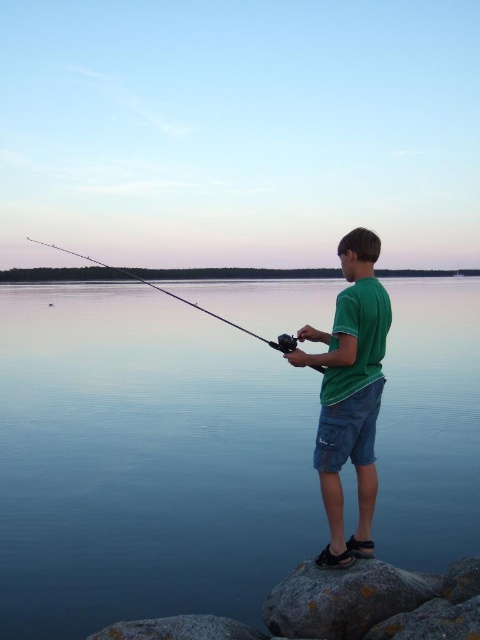
Question: Does transparent blue water at center have a smaller size compared to smooth gray rock at lower center?

Choices:
 (A) no
 (B) yes

Answer: (A)

Question: Which of the following is the closest to the observer?

Choices:
 (A) (127, 627)
 (B) (317, 628)
 (C) (372, 289)

Answer: (A)

Question: Does green cotton shirt at center appear under smooth gray rock at lower center?

Choices:
 (A) no
 (B) yes

Answer: (A)

Question: Which object appears closest to the camera in this image?

Choices:
 (A) green cotton shirt at center
 (B) shiny metallic rod at center

Answer: (A)

Question: Which point is farther from the camera taking this photo?

Choices:
 (A) (285, 340)
 (B) (216, 618)
 (C) (407, 387)
 (D) (324, 584)

Answer: (C)

Question: Is green cotton shirt at center in front of smooth gray rock at lower center?

Choices:
 (A) yes
 (B) no

Answer: (B)